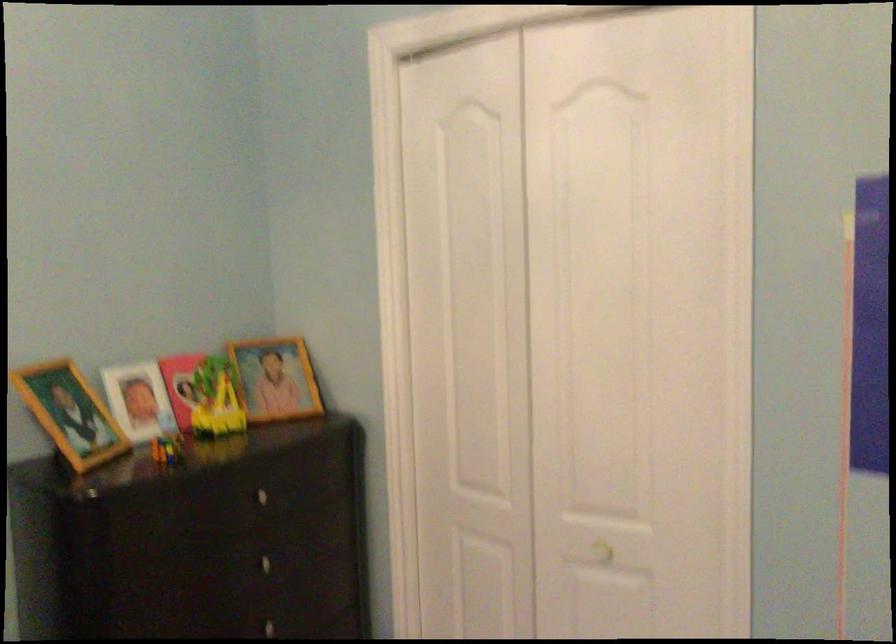
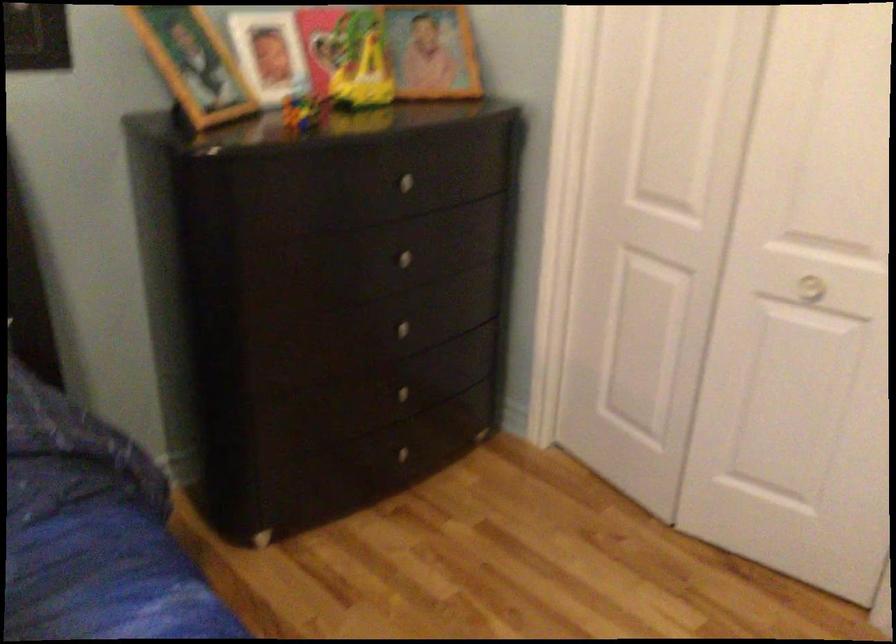
Where in the second image is the point corresponding to point 167,446 from the first image?

(303, 111)